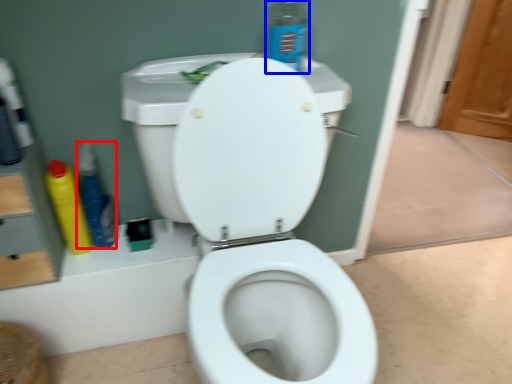
Question: Which of the following is the farthest to the observer, cleaning product (highlighted by a red box) or cleaning product (highlighted by a blue box)?

Choices:
 (A) cleaning product
 (B) cleaning product

Answer: (A)